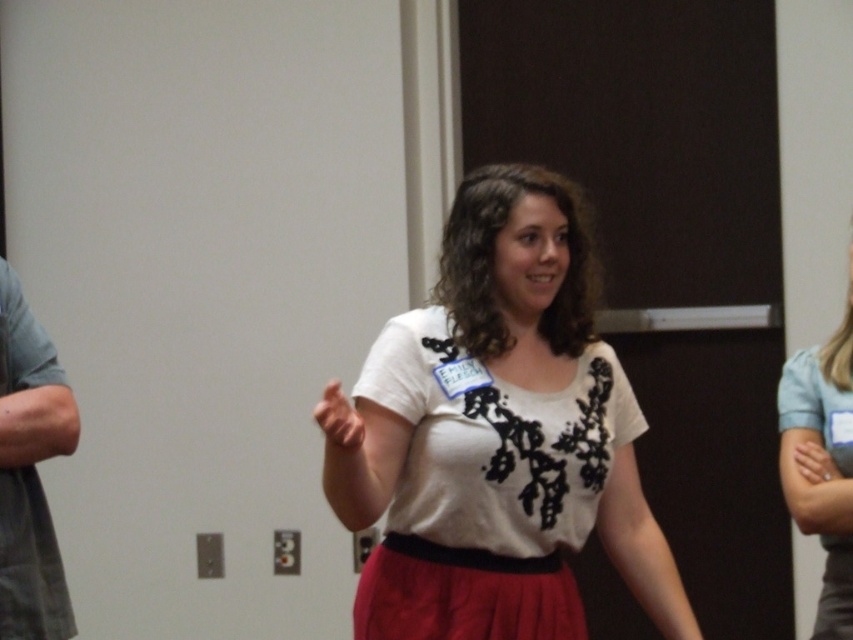
You are a photographer setting up for a group photo. You notice the white matte shirt at center and the gray fabric shirt at left in the frame. Which shirt should you adjust to ensure both are visible in the photo?

The white matte shirt at center is taller than the gray fabric shirt at left, so you should adjust the gray fabric shirt at left to ensure both are visible in the photo.

You are standing in the room where the woman is speaking. You need to locate the gray fabric shirt at left. According to the scene description, where would you look to find it?

The gray fabric shirt at left is located at point (30,472) on the image, which corresponds to the left side of the frame near the bottom.